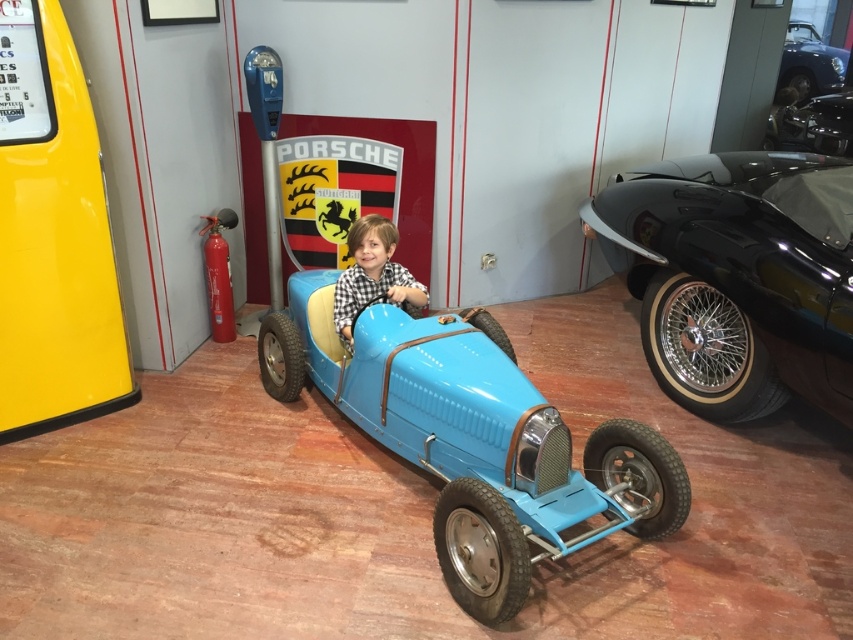
Please describe the object located at the coordinates point (473, 436) in the image.

The object at point (473, 436) is a matte blue toy car at center.

From the picture: You are a tour guide explaining the layout of the car exhibit to visitors. You mention the shiny black car at right and the shiny chrome engine at center. Which object is located to the left of the other?

The shiny black car at right is positioned on the left side of the shiny chrome engine at center, so the shiny black car at right is to the left of the shiny chrome engine at center.

Consider the image. You are a parent visiting the museum with your child. You see the matte blue toy car at center and the matte blue car at center. Which one is placed above the other?

The matte blue car at center is placed above the matte blue toy car at center because the toy car is positioned under the car.